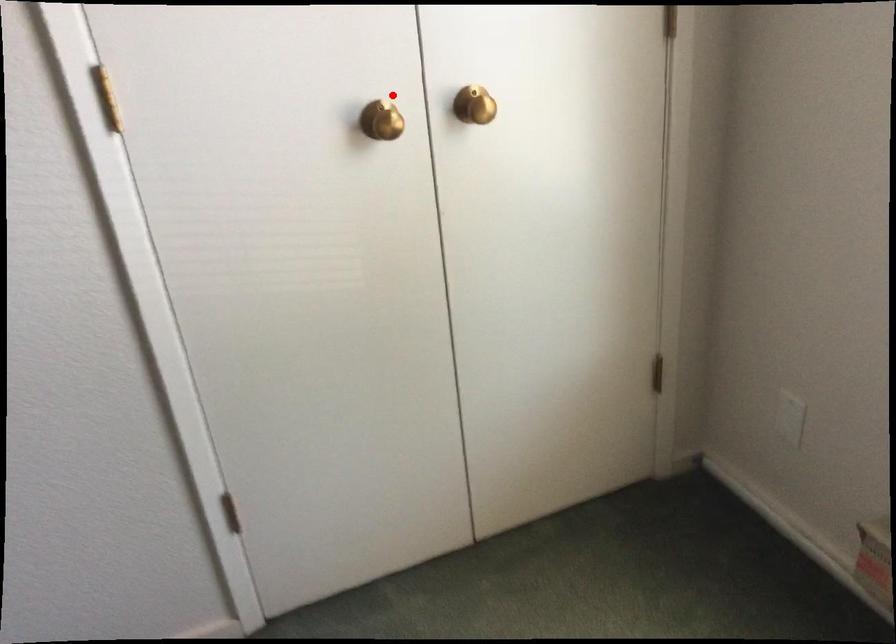
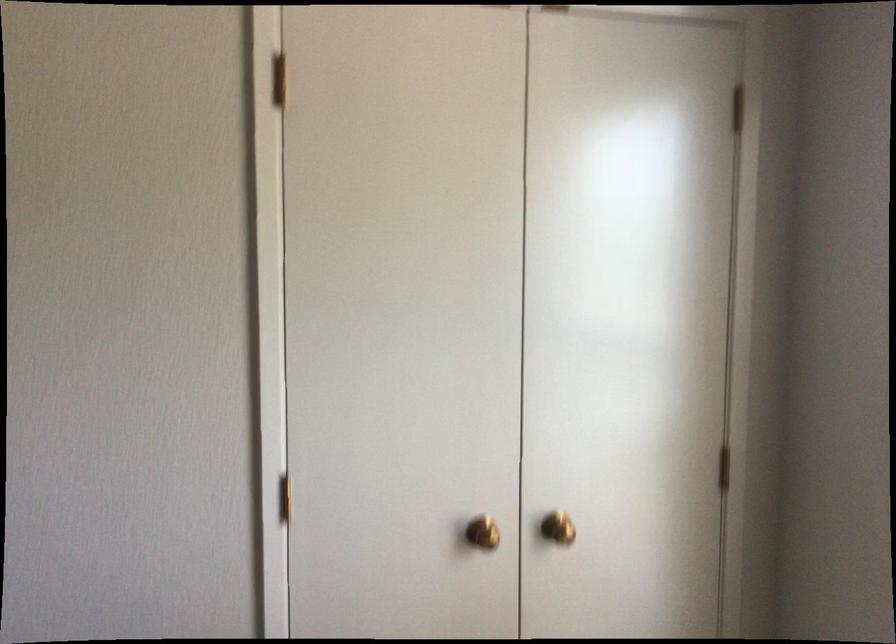
Question: I am providing you with two images of the same scene from different viewpoints. Given a red point in image1, look at the same physical point in image2. Is it:

Choices:
 (A) Closer to the viewpoint
 (B) Farther from the viewpoint

Answer: (B)